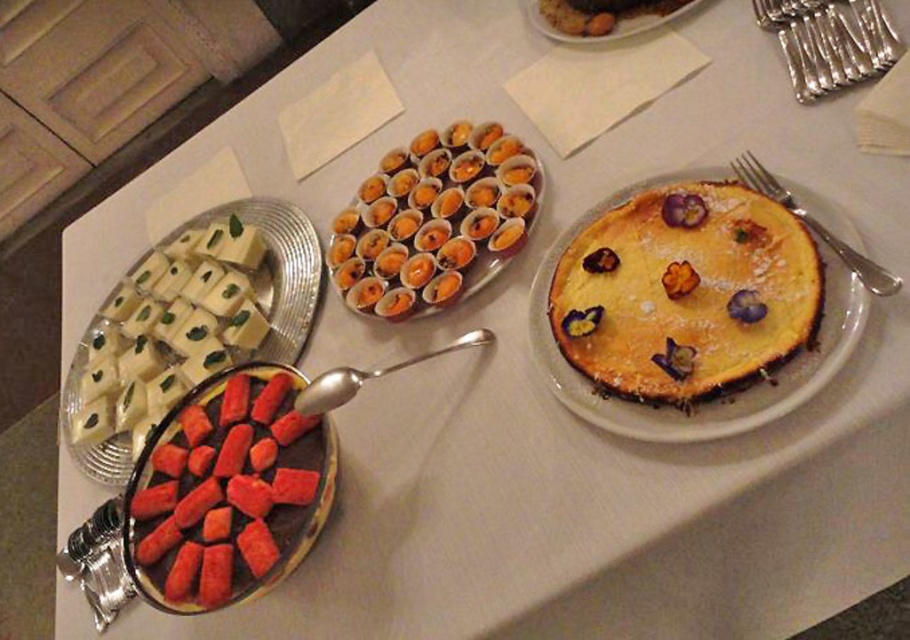
Question: Is white creamy cheese at upper left to the left of silver metallic forks at upper right from the viewer's perspective?

Choices:
 (A) yes
 (B) no

Answer: (A)

Question: Is silver fork at right positioned in front of smooth ceramic plate at upper center?

Choices:
 (A) yes
 (B) no

Answer: (A)

Question: Which point appears farthest from the camera in this image?

Choices:
 (A) (213, 480)
 (B) (337, 372)
 (C) (558, 36)
 (D) (387, 180)

Answer: (C)

Question: Which point is closer to the camera taking this photo?

Choices:
 (A) (716, 432)
 (B) (396, 364)
 (C) (524, 166)
 (D) (117, 460)

Answer: (A)

Question: Which is farther from the silver metallic forks at upper right?

Choices:
 (A) silver spoon at center
 (B) silver fork at right
 (C) smooth ceramic plate at upper center

Answer: (A)

Question: Can you confirm if white creamy cheese at upper left is wider than silver metallic forks at upper right?

Choices:
 (A) yes
 (B) no

Answer: (A)